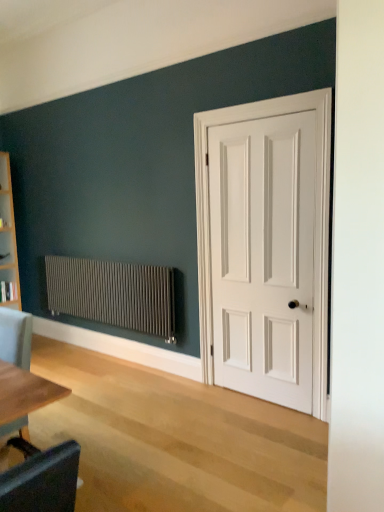
I want to click on matte gray radiator at left, so click(113, 294).

Locate an element on the screen. light gray fabric chair at lower left is located at coordinates (15, 337).

Locate an element on the screen. The height and width of the screenshot is (512, 384). matte gray radiator at left is located at coordinates (113, 294).

Considering the relative sizes of white matte door at right and matte gray radiator at left in the image provided, is white matte door at right smaller than matte gray radiator at left?

Correct, white matte door at right occupies less space than matte gray radiator at left.

Which point is more forward, (315, 348) or (137, 273)?

Point (315, 348)

You are a GUI agent. You are given a task and a screenshot of the screen. Output one action in this format:
    pyautogui.click(x=<x>, y=<y>)
    Task: Click on the door located above the matte gray radiator at left (from a real-world perspective)
    
    Given the screenshot: What is the action you would take?
    pyautogui.click(x=314, y=225)

Visually, is white matte door at right positioned to the left or to the right of matte gray radiator at left?

white matte door at right is positioned on matte gray radiator at left's right side.

Are white matte door at right and light gray fabric chair at lower left making contact?

No, white matte door at right is not making contact with light gray fabric chair at lower left.

Consider the image. Does white matte door at right appear on the left side of light gray fabric chair at lower left?

No, white matte door at right is not to the left of light gray fabric chair at lower left.

Considering the positions of points (323, 158) and (3, 320), is point (323, 158) farther from camera compared to point (3, 320)?

Yes, point (323, 158) is farther from viewer.

From the image's perspective, between white matte door at right and light gray fabric chair at lower left, which one is located above?

white matte door at right appears higher in the image.

Is light gray fabric chair at lower left completely or partially inside matte gray radiator at left?

No, light gray fabric chair at lower left is not inside matte gray radiator at left.

Measure the distance from matte gray radiator at left to light gray fabric chair at lower left.

The distance of matte gray radiator at left from light gray fabric chair at lower left is 5.30 feet.

Based on the photo, which object is closer to the camera, matte gray radiator at left or light gray fabric chair at lower left?

light gray fabric chair at lower left.

Considering the sizes of objects light gray fabric chair at lower left and matte gray radiator at left in the image provided, who is taller, light gray fabric chair at lower left or matte gray radiator at left?

With more height is light gray fabric chair at lower left.

Is light gray fabric chair at lower left inside or outside of matte gray radiator at left?

light gray fabric chair at lower left is spatially situated outside matte gray radiator at left.

Consider the image. Could you tell me if light gray fabric chair at lower left is turned towards matte gray radiator at left?

No, light gray fabric chair at lower left is not aimed at matte gray radiator at left.

Is matte gray radiator at left behind white matte door at right?

Yes, matte gray radiator at left is behind white matte door at right.

Could you tell me if matte gray radiator at left is turned towards white matte door at right?

No, matte gray radiator at left is not aimed at white matte door at right.

I want to click on door above the matte gray radiator at left (from a real-world perspective), so click(314, 225).

Between point (51, 304) and point (326, 131), which one is positioned behind?

The point (51, 304) is behind.

Is light gray fabric chair at lower left not near white matte door at right?

light gray fabric chair at lower left is far away from white matte door at right.

Could white matte door at right be considered to be inside light gray fabric chair at lower left?

Actually, white matte door at right is outside light gray fabric chair at lower left.

Considering the relative sizes of light gray fabric chair at lower left and white matte door at right in the image provided, is light gray fabric chair at lower left wider than white matte door at right?

Indeed, light gray fabric chair at lower left has a greater width compared to white matte door at right.

Considering the sizes of objects light gray fabric chair at lower left and white matte door at right in the image provided, who is shorter, light gray fabric chair at lower left or white matte door at right?

With less height is light gray fabric chair at lower left.

The height and width of the screenshot is (512, 384). I want to click on door in front of the matte gray radiator at left, so click(314, 225).

What are the coordinates of `door that appears above the light gray fabric chair at lower left (from the image's perspective)` in the screenshot? It's located at (314, 225).

When comparing their distances from matte gray radiator at left, does white matte door at right or light gray fabric chair at lower left seem further?

The object further to matte gray radiator at left is light gray fabric chair at lower left.

From the image, which object appears to be nearer to white matte door at right, light gray fabric chair at lower left or matte gray radiator at left?

matte gray radiator at left.

Estimate the real-world distances between objects in this image. Which object is further from matte gray radiator at left, light gray fabric chair at lower left or white matte door at right?

light gray fabric chair at lower left is further to matte gray radiator at left.

Based on their spatial positions, is matte gray radiator at left or light gray fabric chair at lower left closer to white matte door at right?

matte gray radiator at left is positioned closer to the anchor white matte door at right.

Which object lies nearer to the anchor point light gray fabric chair at lower left, matte gray radiator at left or white matte door at right?

Based on the image, matte gray radiator at left appears to be nearer to light gray fabric chair at lower left.

Which object lies further to the anchor point light gray fabric chair at lower left, white matte door at right or matte gray radiator at left?

white matte door at right is further to light gray fabric chair at lower left.

The image size is (384, 512). I want to click on radiator between light gray fabric chair at lower left and white matte door at right from left to right, so click(x=113, y=294).